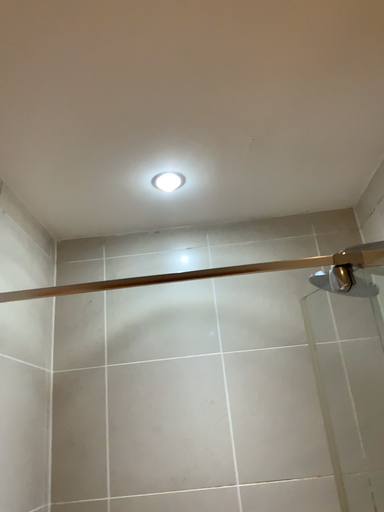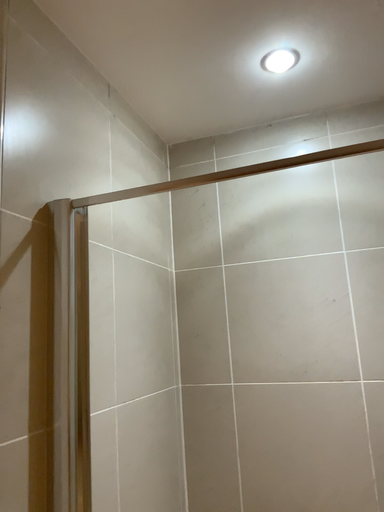
Question: How did the camera likely rotate when shooting the video?

Choices:
 (A) rotated downward
 (B) rotated upward

Answer: (A)